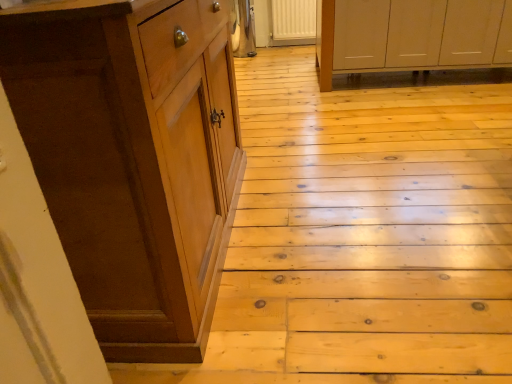
Where is `wooden at left`? This screenshot has width=512, height=384. wooden at left is located at coordinates (362, 236).

What do you see at coordinates (132, 158) in the screenshot? I see `brown wood cabinet at left, the first cabinetry ordered from the bottom` at bounding box center [132, 158].

The height and width of the screenshot is (384, 512). Find the location of `white matte cabinet at upper right, arranged as the 1th cabinetry when viewed from the top`. white matte cabinet at upper right, arranged as the 1th cabinetry when viewed from the top is located at coordinates (411, 36).

Is wooden at left at the back of white matte cabinet at upper right, the first cabinetry from the right?

No, white matte cabinet at upper right, the first cabinetry from the right,'s orientation is not away from wooden at left.

From a real-world perspective, relative to wooden at left, is white matte cabinet at upper right, arranged as the 1th cabinetry when viewed from the top, vertically above or below?

From a real-world perspective, white matte cabinet at upper right, arranged as the 1th cabinetry when viewed from the top, is physically above wooden at left.

Is white matte cabinet at upper right, arranged as the 2th cabinetry when viewed from the front, beside wooden at left?

There is a gap between white matte cabinet at upper right, arranged as the 2th cabinetry when viewed from the front, and wooden at left.

Is wooden at left in front of or behind brown wood cabinet at left, the first cabinetry ordered from the bottom, in the image?

Clearly, wooden at left is behind brown wood cabinet at left, the first cabinetry ordered from the bottom.

Between wooden at left and brown wood cabinet at left, the 2th cabinetry from the right, which one has more height?

Standing taller between the two is brown wood cabinet at left, the 2th cabinetry from the right.

Which is more to the left, wooden at left or brown wood cabinet at left, which is the 2th cabinetry in top-to-bottom order?

brown wood cabinet at left, which is the 2th cabinetry in top-to-bottom order, is more to the left.

Is white matte cabinet at upper right, the first cabinetry from the right, located within wooden at left?

No, wooden at left does not contain white matte cabinet at upper right, the first cabinetry from the right.

You are a GUI agent. You are given a task and a screenshot of the screen. Output one action in this format:
    pyautogui.click(x=<x>, y=<y>)
    Task: Click on the cabinetry on the right of wooden at left
    This screenshot has height=384, width=512.
    Given the screenshot: What is the action you would take?
    pyautogui.click(x=411, y=36)

Can you confirm if wooden at left is bigger than white matte cabinet at upper right, positioned as the 2th cabinetry in left-to-right order?

No, wooden at left is not bigger than white matte cabinet at upper right, positioned as the 2th cabinetry in left-to-right order.

Is brown wood cabinet at left, the first cabinetry viewed from the left, situated inside wooden at left or outside?

brown wood cabinet at left, the first cabinetry viewed from the left, exists outside the volume of wooden at left.

Is brown wood cabinet at left, the first cabinetry viewed from the left, at the right side of wooden at left?

Incorrect, brown wood cabinet at left, the first cabinetry viewed from the left, is not on the right side of wooden at left.

Is brown wood cabinet at left, the first cabinetry viewed from the left, further to camera compared to wooden at left?

That is False.

From the image's perspective, is brown wood cabinet at left, which is the first cabinetry from front to back, over wooden at left?

No.

From the image's perspective, between brown wood cabinet at left, the first cabinetry ordered from the bottom, and white matte cabinet at upper right, arranged as the 1th cabinetry when viewed from the top, which one is located above?

white matte cabinet at upper right, arranged as the 1th cabinetry when viewed from the top, from the image's perspective.

Which object is more forward, brown wood cabinet at left, the 2th cabinetry from the right, or white matte cabinet at upper right, arranged as the 2th cabinetry when viewed from the front?

brown wood cabinet at left, the 2th cabinetry from the right, is more forward.

Between brown wood cabinet at left, which is the 2th cabinetry in back-to-front order, and white matte cabinet at upper right, arranged as the 2th cabinetry when viewed from the front, which one has smaller width?

brown wood cabinet at left, which is the 2th cabinetry in back-to-front order, is thinner.

Is brown wood cabinet at left, which is the 2th cabinetry in top-to-bottom order, smaller than white matte cabinet at upper right, positioned as the 2th cabinetry in left-to-right order?

Yes, brown wood cabinet at left, which is the 2th cabinetry in top-to-bottom order, is smaller than white matte cabinet at upper right, positioned as the 2th cabinetry in left-to-right order.

Is white matte cabinet at upper right, arranged as the 1th cabinetry when viewed from the top, aimed at brown wood cabinet at left, which is the first cabinetry from front to back?

Yes, white matte cabinet at upper right, arranged as the 1th cabinetry when viewed from the top, is aimed at brown wood cabinet at left, which is the first cabinetry from front to back.

How far apart are white matte cabinet at upper right, the 2th cabinetry in the bottom-to-top sequence, and brown wood cabinet at left, the first cabinetry ordered from the bottom?

white matte cabinet at upper right, the 2th cabinetry in the bottom-to-top sequence, and brown wood cabinet at left, the first cabinetry ordered from the bottom, are 6.91 feet apart.

Between white matte cabinet at upper right, the first cabinetry from the right, and brown wood cabinet at left, the 2th cabinetry from the right, which one has less height?

white matte cabinet at upper right, the first cabinetry from the right.

Where is `cabinetry that appears below the white matte cabinet at upper right, positioned as the 2th cabinetry in left-to-right order (from the image's perspective)`? The width and height of the screenshot is (512, 384). cabinetry that appears below the white matte cabinet at upper right, positioned as the 2th cabinetry in left-to-right order (from the image's perspective) is located at coordinates (132, 158).

At what (x,y) coordinates should I click in order to perform the action: click on stair on the left side of white matte cabinet at upper right, the 2th cabinetry in the bottom-to-top sequence. Please return your answer as a coordinate pair (x, y). Looking at the image, I should click on (362, 236).

Find the location of a particular element. stair directly beneath the brown wood cabinet at left, the first cabinetry ordered from the bottom (from a real-world perspective) is located at coordinates (362, 236).

Considering their positions, is white matte cabinet at upper right, arranged as the 2th cabinetry when viewed from the front, positioned further to wooden at left than brown wood cabinet at left, which is the 2th cabinetry in top-to-bottom order?

white matte cabinet at upper right, arranged as the 2th cabinetry when viewed from the front, lies further to wooden at left than the other object.

Based on their spatial positions, is wooden at left or white matte cabinet at upper right, the 2th cabinetry in the bottom-to-top sequence, closer to brown wood cabinet at left, the first cabinetry ordered from the bottom?

wooden at left lies closer to brown wood cabinet at left, the first cabinetry ordered from the bottom, than the other object.

From the image, which object appears to be nearer to white matte cabinet at upper right, the 2th cabinetry in the bottom-to-top sequence, wooden at left or brown wood cabinet at left, the 2th cabinetry from the right?

wooden at left lies closer to white matte cabinet at upper right, the 2th cabinetry in the bottom-to-top sequence, than the other object.

When comparing their distances from wooden at left, does brown wood cabinet at left, which is the first cabinetry from front to back, or white matte cabinet at upper right, the 2th cabinetry in the bottom-to-top sequence, seem closer?

Among the two, brown wood cabinet at left, which is the first cabinetry from front to back, is located nearer to wooden at left.

When comparing their distances from white matte cabinet at upper right, arranged as the 2th cabinetry when viewed from the front, does brown wood cabinet at left, which is the first cabinetry from front to back, or wooden at left seem closer?

wooden at left is closer to white matte cabinet at upper right, arranged as the 2th cabinetry when viewed from the front.

Which object lies further to the anchor point brown wood cabinet at left, the 2th cabinetry from the right, white matte cabinet at upper right, the 2th cabinetry in the bottom-to-top sequence, or wooden at left?

white matte cabinet at upper right, the 2th cabinetry in the bottom-to-top sequence.

The height and width of the screenshot is (384, 512). Identify the location of stair between brown wood cabinet at left, which is the first cabinetry from front to back, and white matte cabinet at upper right, positioned as the 2th cabinetry in left-to-right order, in the front-back direction. (x=362, y=236).